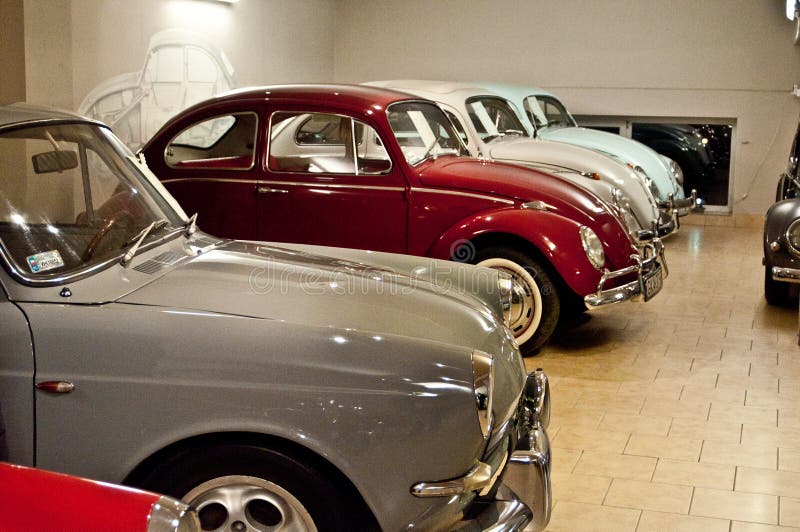
Find the location of a particular element. exposed flooring  are brick sized and dark creme colored with dark grout is located at coordinates (661, 365).